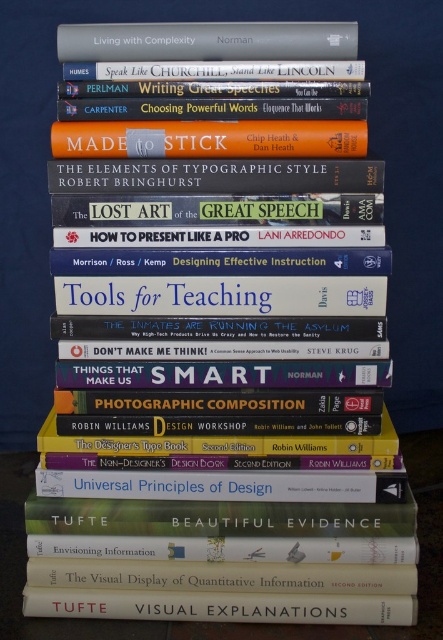
Is matte white book at center taller than hardcover book at upper center?

No.

Locate an element on the screen. The image size is (443, 640). matte white book at center is located at coordinates (220, 605).

Identify the location of matte white book at center. The height and width of the screenshot is (640, 443). (x=220, y=605).

Locate an element on the screen. matte white book at center is located at coordinates (220, 605).